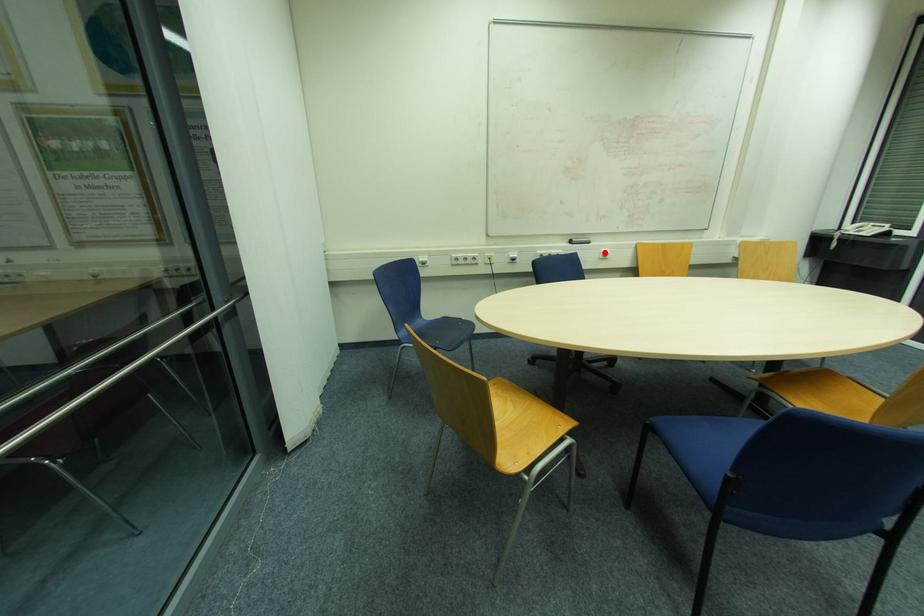
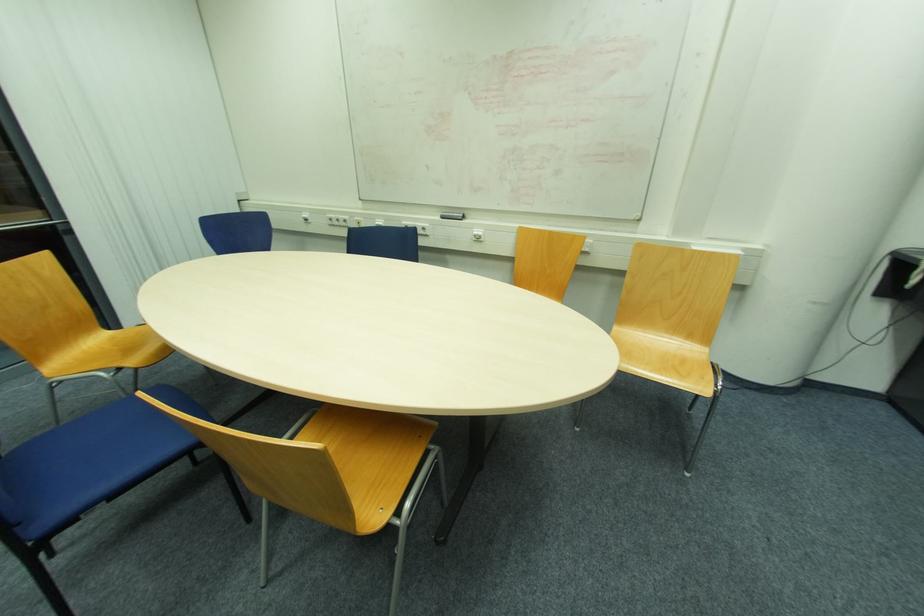
Locate, in the second image, the point that corresponds to the highlighted location in the first image.

(477, 233)